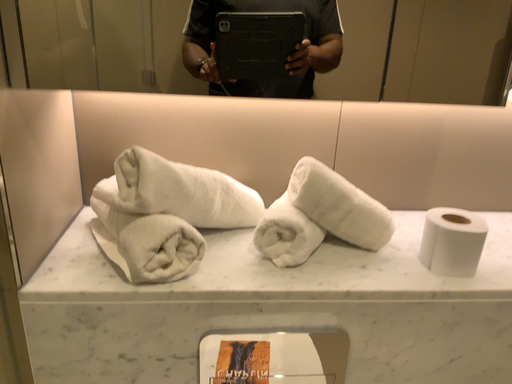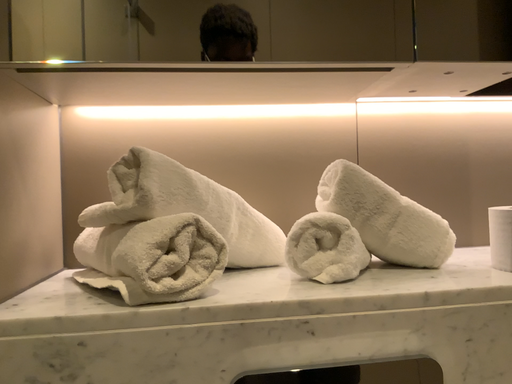
Question: Which way did the camera rotate in the video?

Choices:
 (A) rotated downward
 (B) rotated upward

Answer: (B)